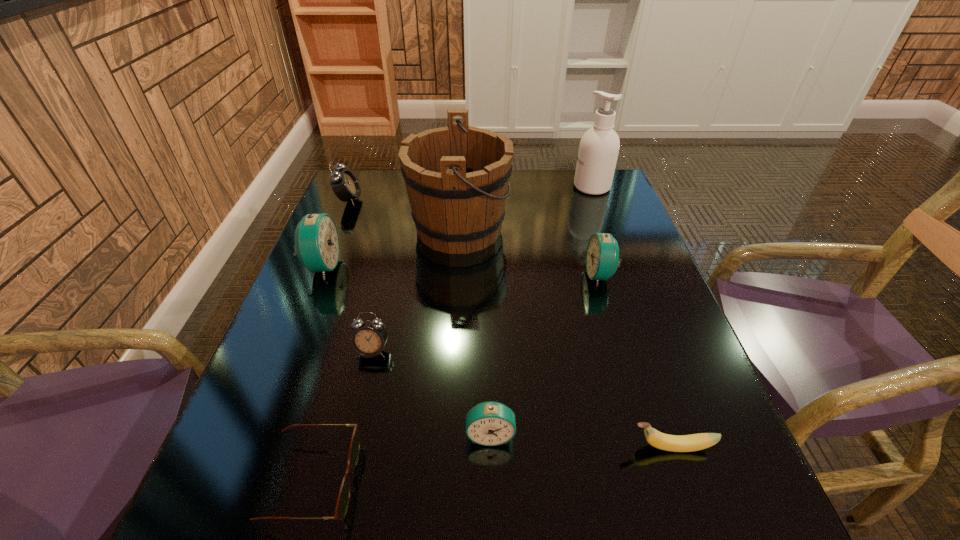
At what (x,y) coordinates should I click in order to perform the action: click on vacant space located 0.310m on the front-facing side of the biggest blue alarm clock. Please return your answer as a coordinate pair (x, y). Image resolution: width=960 pixels, height=540 pixels. Looking at the image, I should click on (465, 266).

Where is `free spot located 0.380m on the face of the bigger white alarm clock`? The height and width of the screenshot is (540, 960). free spot located 0.380m on the face of the bigger white alarm clock is located at coordinates (489, 199).

Find the location of a particular element. The height and width of the screenshot is (540, 960). vacant space located on the front-facing side of the second biggest blue alarm clock is located at coordinates (512, 275).

The image size is (960, 540). Find the location of `free spot located on the front-facing side of the second biggest blue alarm clock`. free spot located on the front-facing side of the second biggest blue alarm clock is located at coordinates (516, 275).

Where is `vacant area situated 0.130m on the front-facing side of the second biggest blue alarm clock`? The image size is (960, 540). vacant area situated 0.130m on the front-facing side of the second biggest blue alarm clock is located at coordinates (532, 275).

You are a GUI agent. You are given a task and a screenshot of the screen. Output one action in this format:
    pyautogui.click(x=<x>, y=<y>)
    Task: Click on the free spot located 0.120m on the face of the nearer white alarm clock
    
    Given the screenshot: What is the action you would take?
    pyautogui.click(x=357, y=416)

Where is `vacant area situated 0.090m on the front-facing side of the smallest blue alarm clock`? The image size is (960, 540). vacant area situated 0.090m on the front-facing side of the smallest blue alarm clock is located at coordinates (492, 504).

You are a GUI agent. You are given a task and a screenshot of the screen. Output one action in this format:
    pyautogui.click(x=<x>, y=<y>)
    Task: Click on the vacant space situated 0.110m at the stem of the yellow banana
    This screenshot has height=540, width=960.
    Given the screenshot: What is the action you would take?
    pyautogui.click(x=563, y=447)

Identify the location of free region located 0.150m at the stem of the yellow banana. (540, 447).

I want to click on vacant space located 0.360m at the stem of the yellow banana, so 415,447.